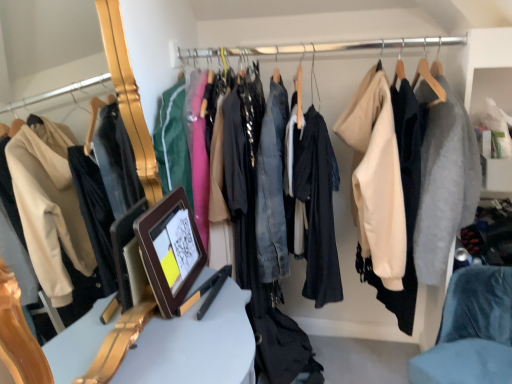
Question: From the image's perspective, is white glossy table at center located above or below velvet blue chair at lower right?

Choices:
 (A) below
 (B) above

Answer: (B)

Question: Is point (217, 319) positioned closer to the camera than point (470, 372)?

Choices:
 (A) farther
 (B) closer

Answer: (B)

Question: Considering the real-world distances, which object is closest to the white glossy table at center?

Choices:
 (A) velvet blue chair at lower right
 (B) brown wooden picture frame at center

Answer: (B)

Question: Which object is the farthest from the white glossy table at center?

Choices:
 (A) velvet blue chair at lower right
 (B) brown wooden picture frame at center

Answer: (A)